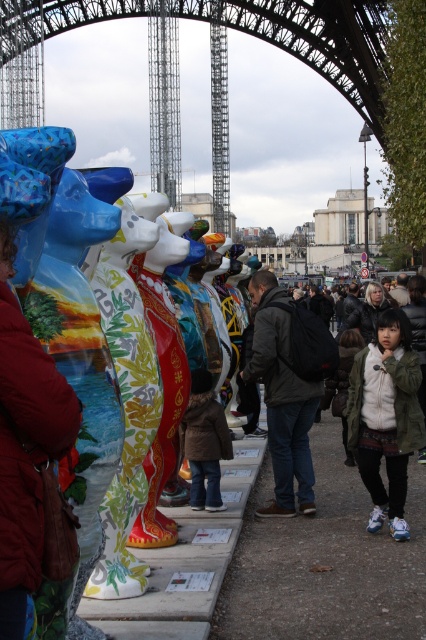
Is point (37, 483) positioned after point (403, 476)?

No, it is in front of (403, 476).

Does matte red coat at center appear on the left side of matte olive green jacket at lower right?

Indeed, matte red coat at center is positioned on the left side of matte olive green jacket at lower right.

Locate an element on the screen. The height and width of the screenshot is (640, 426). matte red coat at center is located at coordinates (25, 445).

I want to click on matte red coat at center, so 25,445.

Who is higher up, dark gray backpack at center or brushed metal eiffel tower at center?

brushed metal eiffel tower at center is higher up.

Between dark gray backpack at center and brushed metal eiffel tower at center, which one appears on the right side from the viewer's perspective?

dark gray backpack at center is more to the right.

Does point (273, 280) come in front of point (218, 83)?

That is True.

Locate an element on the screen. The image size is (426, 640). dark gray backpack at center is located at coordinates (285, 392).

Is point (6, 234) positioned behind point (285, 448)?

No, (6, 234) is closer to viewer.

I want to click on matte red coat at center, so click(25, 445).

At what (x,y) coordinates should I click in order to perform the action: click on matte red coat at center. Please return your answer as a coordinate pair (x, y). The image size is (426, 640). Looking at the image, I should click on (25, 445).